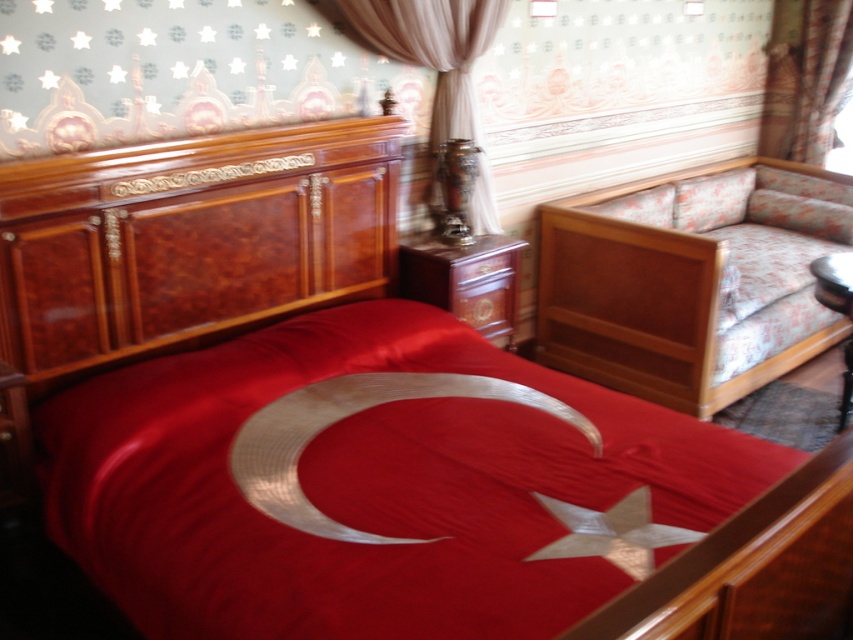
The image size is (853, 640). What do you see at coordinates (190, 237) in the screenshot?
I see `burlwood headboard at left` at bounding box center [190, 237].

Can you confirm if burlwood headboard at left is positioned above satin curtain at upper right?

No, burlwood headboard at left is not above satin curtain at upper right.

At what (x,y) coordinates should I click in order to perform the action: click on burlwood headboard at left. Please return your answer as a coordinate pair (x, y). Image resolution: width=853 pixels, height=640 pixels. Looking at the image, I should click on (190, 237).

Which of these two, sheer beige curtain at center or satin curtain at upper right, stands shorter?

Standing shorter between the two is sheer beige curtain at center.

Is sheer beige curtain at center further to camera compared to satin curtain at upper right?

No, sheer beige curtain at center is closer to the viewer.

The image size is (853, 640). I want to click on sheer beige curtain at center, so click(x=426, y=48).

Does wooden bed frame at right have a lesser width compared to satin curtain at upper right?

In fact, wooden bed frame at right might be wider than satin curtain at upper right.

Can you confirm if wooden bed frame at right is taller than satin curtain at upper right?

Correct, wooden bed frame at right is much taller as satin curtain at upper right.

You are a GUI agent. You are given a task and a screenshot of the screen. Output one action in this format:
    pyautogui.click(x=<x>, y=<y>)
    Task: Click on the wooden bed frame at right
    The width and height of the screenshot is (853, 640).
    Given the screenshot: What is the action you would take?
    pyautogui.click(x=688, y=280)